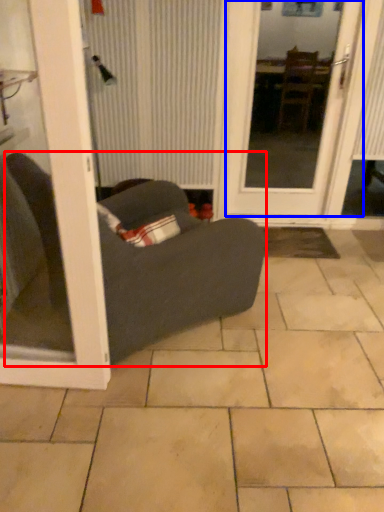
Question: Which of the following is the closest to the observer, studio couch (highlighted by a red box) or door (highlighted by a blue box)?

Choices:
 (A) studio couch
 (B) door

Answer: (A)